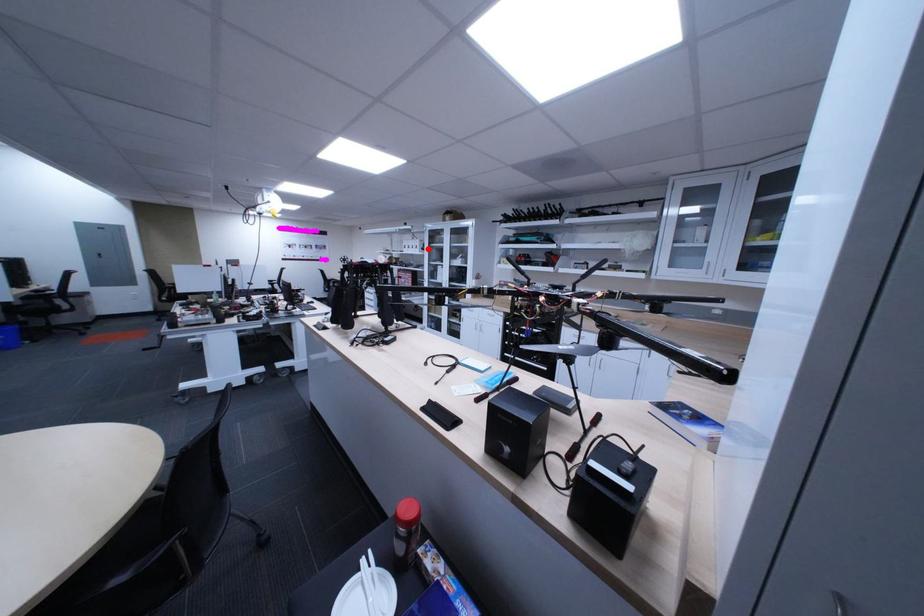
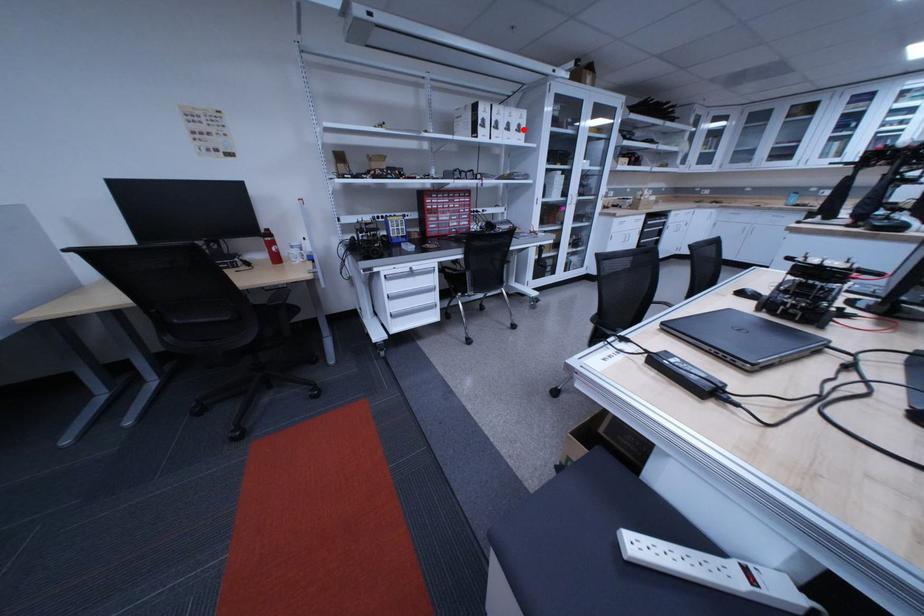
In the scene shown: I am providing you with two images of the same scene from different viewpoints. A red point is marked on the first image and another point is marked on the second image. Is the red point in image1 aligned with the point shown in image2?

Yes